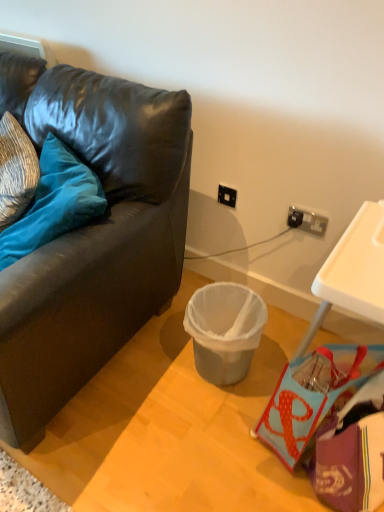
Locate an element on the screen. free space on the front side of gray plastic trash can at center is located at coordinates (216, 429).